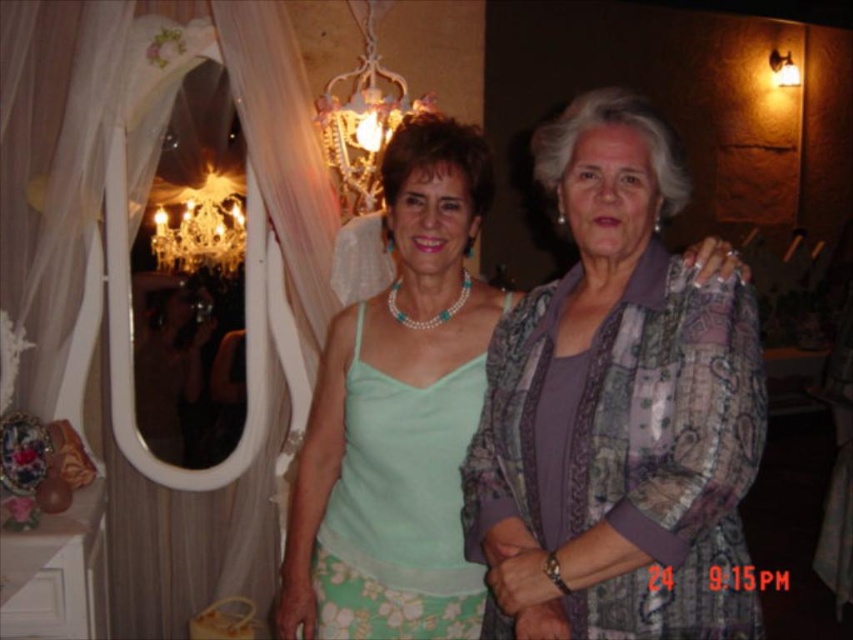
You are at a party and want to take a photo under the crystal glass chandelier at upper left. However, there is a patterned fabric blouse at center in the way. Can you move the blouse out of the frame to get a clear shot of the chandelier?

The patterned fabric blouse at center is located below the crystal glass chandelier at upper left, so moving it out of the frame would allow a clear shot of the chandelier.

You are at a social event and want to take a photo of both women. You notice two points marked in the image. The first point is at coordinate point (x=589, y=509) and the second is at point (x=393, y=76). Which point is closer to the camera?

Point (x=589, y=509) is in front of point (x=393, y=76), so it is closer to the camera.

Looking at this image, you are at a party and want to take a photo under the shiny glass chandelier at upper center. However, there is a patterned fabric blouse at center in the way. Can you move the blouse out of the frame to get a clear shot of the chandelier?

The patterned fabric blouse at center is located below the shiny glass chandelier at upper center, so moving it would allow the chandelier to be clearly visible in the photo.